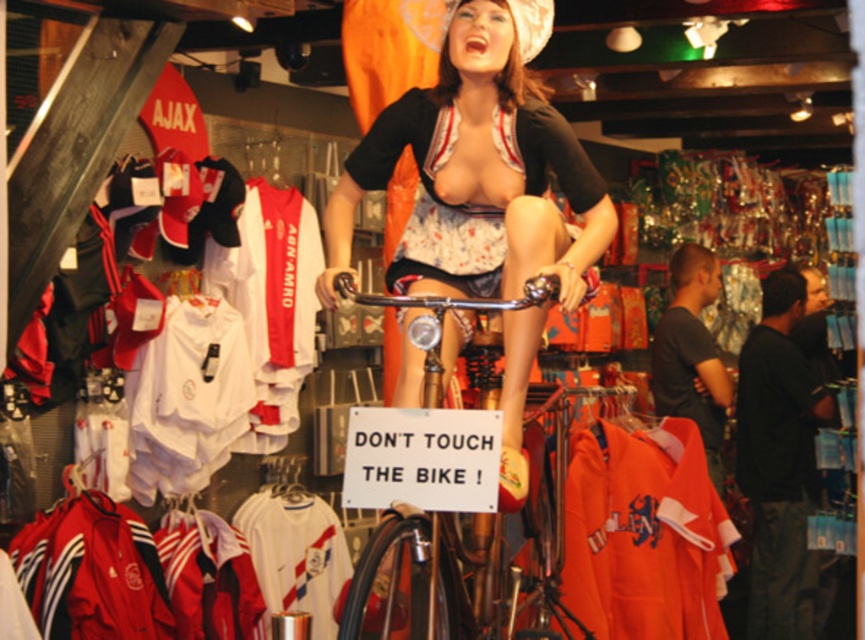
Question: Does black matte bandeau at right come in front of shiny chrome bicycle at center?

Choices:
 (A) yes
 (B) no

Answer: (B)

Question: Which object appears closest to the camera in this image?

Choices:
 (A) black matte bandeau at right
 (B) orange fabric hoodie at center
 (C) shiny chrome bicycle at center

Answer: (C)

Question: Considering the real-world distances, which object is closest to the orange fabric hoodie at center?

Choices:
 (A) matte black bicycle at center
 (B) black matte bandeau at right
 (C) shiny chrome bicycle at center

Answer: (B)

Question: Which point appears farthest from the camera in this image?

Choices:
 (A) click(x=537, y=292)
 (B) click(x=748, y=410)

Answer: (B)

Question: Is orange fabric hoodie at center smaller than shiny chrome bicycle at center?

Choices:
 (A) yes
 (B) no

Answer: (B)

Question: Observing the image, what is the correct spatial positioning of orange fabric hoodie at center in reference to shiny chrome bicycle at center?

Choices:
 (A) left
 (B) right

Answer: (B)